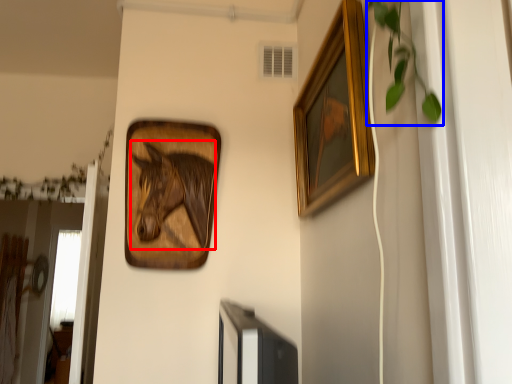
Question: Which point is further to the camera, animal (highlighted by a red box) or plant (highlighted by a blue box)?

Choices:
 (A) animal
 (B) plant

Answer: (A)